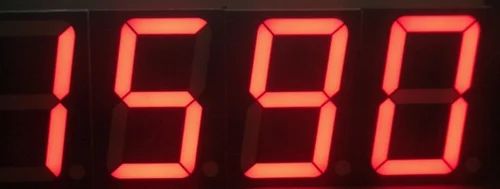
The height and width of the screenshot is (189, 500). I want to click on digital clock face, so click(x=224, y=102).